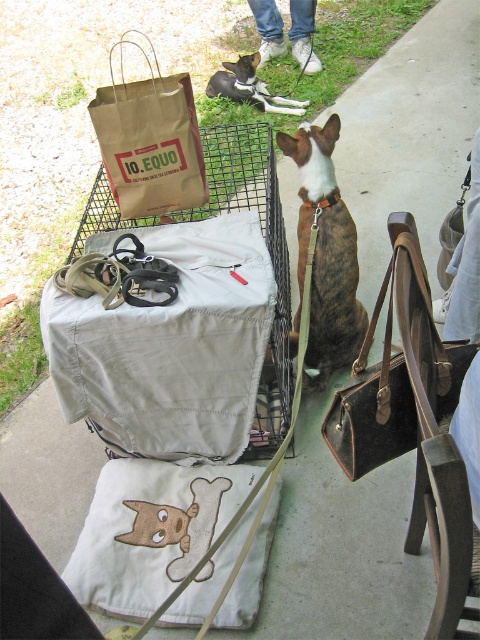
Question: Which object is positioned farthest from the matte black leash at center?

Choices:
 (A) black and white fur at center
 (B) brown paper bag at upper left

Answer: (A)

Question: Does matte black leash at center have a larger size compared to black and white fur at center?

Choices:
 (A) no
 (B) yes

Answer: (B)

Question: Does brown leather dog at center appear on the left side of brown leather bag at center-right?

Choices:
 (A) yes
 (B) no

Answer: (A)

Question: Among these objects, which one is nearest to the camera?

Choices:
 (A) brown paper bag at upper left
 (B) black and white fur at center
 (C) matte black leash at center

Answer: (C)

Question: Which of the following is the farthest from the observer?

Choices:
 (A) brown leather dog at center
 (B) matte black leash at center
 (C) brown paper bag at upper left

Answer: (A)

Question: Is matte black leash at center closer to camera compared to brown paper bag at upper left?

Choices:
 (A) yes
 (B) no

Answer: (A)